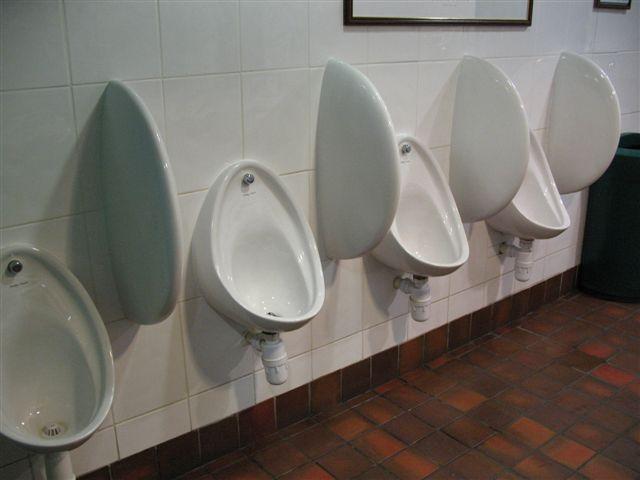
Where is `brown tiles at bottom of wall`? The height and width of the screenshot is (480, 640). brown tiles at bottom of wall is located at coordinates (237, 427).